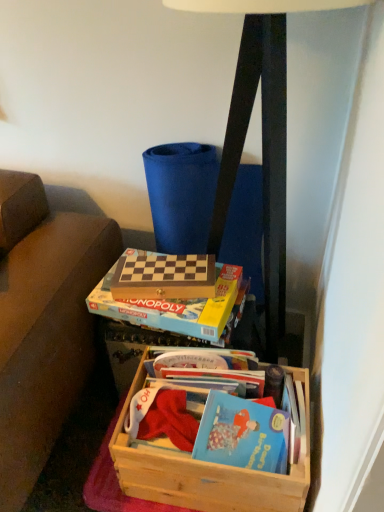
Question: From their relative heights in the image, would you say hardcover book at center, which is counted as the 1th paperback book, starting from the front, is taller or shorter than matte black lamp at upper center?

Choices:
 (A) tall
 (B) short

Answer: (B)

Question: Considering the positions of point (165, 314) and point (249, 86), is point (165, 314) closer or farther from the camera than point (249, 86)?

Choices:
 (A) closer
 (B) farther

Answer: (B)

Question: Estimate the real-world distances between objects in this image. Which object is farther from the wooden crate at lower center?

Choices:
 (A) hardcover book at center, which is the 2th paperback book from back to front
 (B) wooden board game at center, arranged as the second paperback book when viewed from the front
 (C) matte black lamp at upper center

Answer: (C)

Question: Estimate the real-world distances between objects in this image. Which object is farther from the matte black lamp at upper center?

Choices:
 (A) wooden crate at lower center
 (B) wooden board game at center, arranged as the second paperback book when viewed from the front
 (C) hardcover book at center, which is counted as the 1th paperback book, starting from the front

Answer: (A)